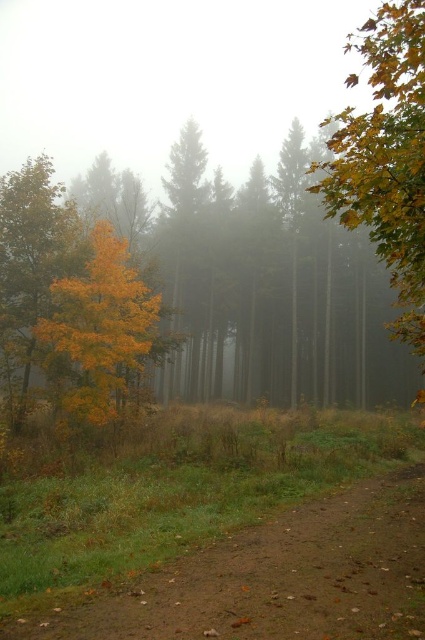
Identify the location of brown dirt path at lower right. (277, 579).

Who is more forward, [421,492] or [136,333]?

Point [421,492] is in front.

The height and width of the screenshot is (640, 425). Find the location of `brown dirt path at lower right`. brown dirt path at lower right is located at coordinates (277, 579).

Measure the distance between golden maple leaf at right and golden yellow leaves at center.

The distance of golden maple leaf at right from golden yellow leaves at center is 53.26 feet.

Which is behind, point (357, 205) or point (107, 241)?

Point (107, 241)

Locate an element on the screen. This screenshot has width=425, height=640. golden maple leaf at right is located at coordinates (385, 157).

This screenshot has height=640, width=425. What are the coordinates of `golden maple leaf at right` in the screenshot? It's located at (385, 157).

Looking at this image, can you confirm if brown dirt path at lower right is positioned to the left of golden maple leaf at right?

Correct, you'll find brown dirt path at lower right to the left of golden maple leaf at right.

Is brown dirt path at lower right shorter than golden maple leaf at right?

Yes.

The height and width of the screenshot is (640, 425). Find the location of `brown dirt path at lower right`. brown dirt path at lower right is located at coordinates (277, 579).